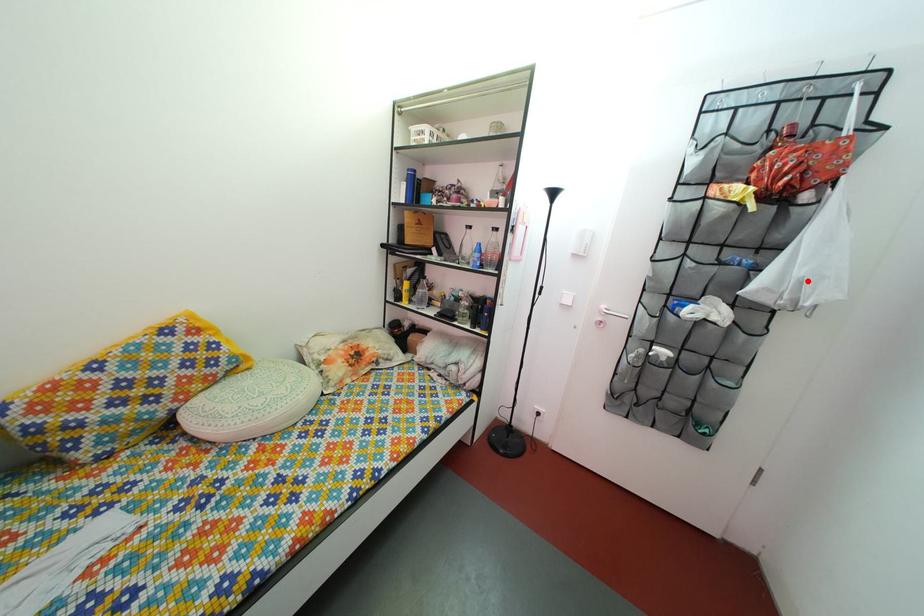
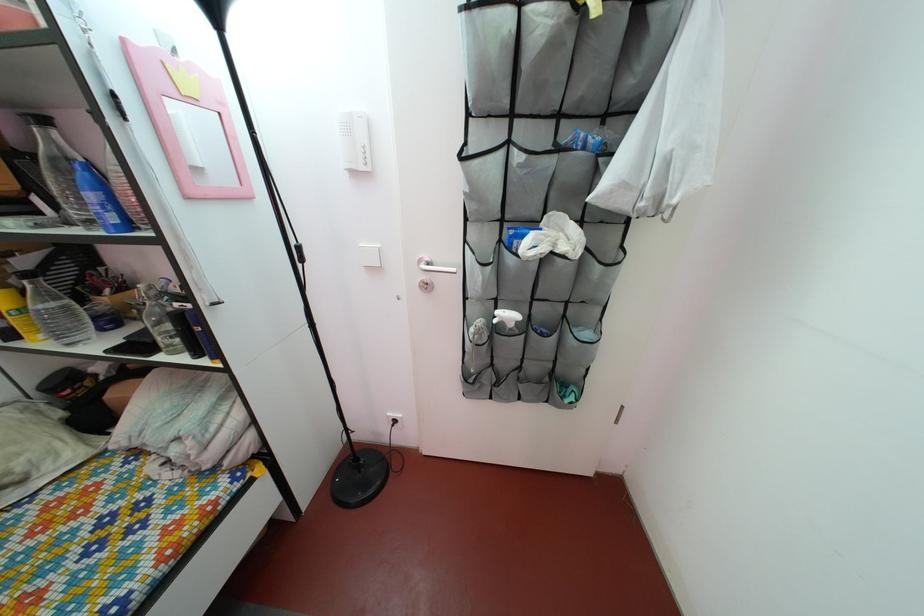
The point at the highlighted location is marked in the first image. Where is the corresponding point in the second image?

(675, 152)